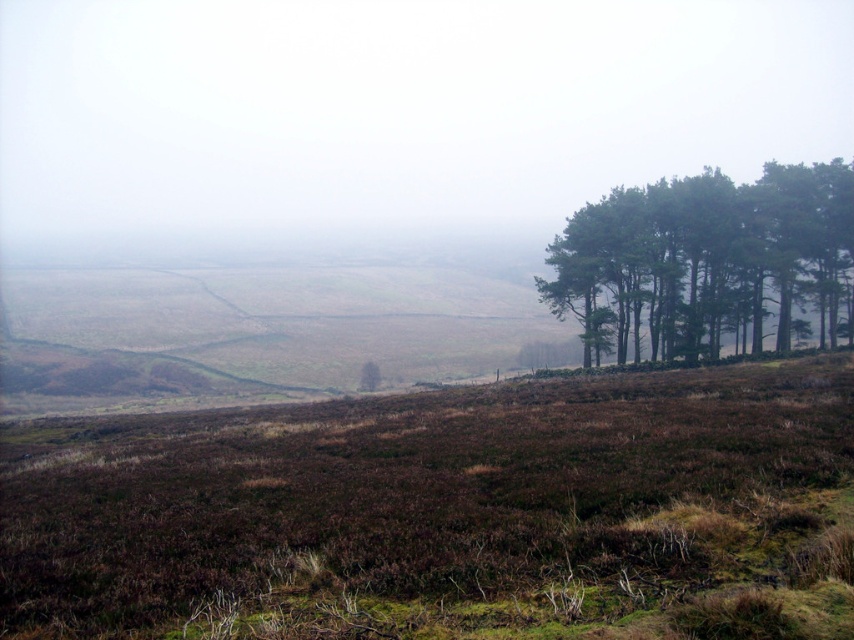
Question: Which point is closer to the camera?

Choices:
 (A) (828, 541)
 (B) (835, 321)

Answer: (A)

Question: Does brown/dry grass at center have a greater width compared to green matte trees at right?

Choices:
 (A) yes
 (B) no

Answer: (A)

Question: Among these objects, which one is farthest from the camera?

Choices:
 (A) green matte trees at right
 (B) brown/dry grass at center

Answer: (A)

Question: Considering the relative positions of brown/dry grass at center and green matte trees at right in the image provided, where is brown/dry grass at center located with respect to green matte trees at right?

Choices:
 (A) above
 (B) below

Answer: (B)

Question: Is brown/dry grass at center smaller than green matte trees at right?

Choices:
 (A) no
 (B) yes

Answer: (A)

Question: Which object appears closest to the camera in this image?

Choices:
 (A) brown/dry grass at center
 (B) green matte trees at right

Answer: (A)